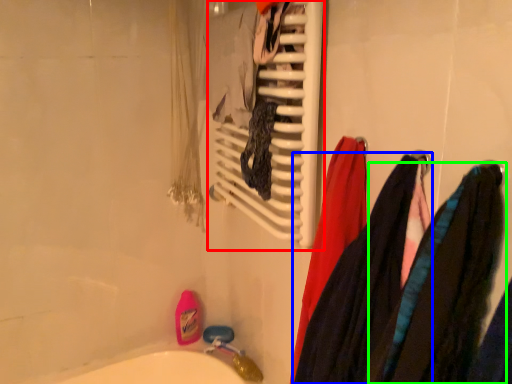
Question: Considering the real-world distances, which object is farthest from towel rack (highlighted by a red box)? clothing (highlighted by a blue box) or clothing (highlighted by a green box)?

Choices:
 (A) clothing
 (B) clothing

Answer: (B)